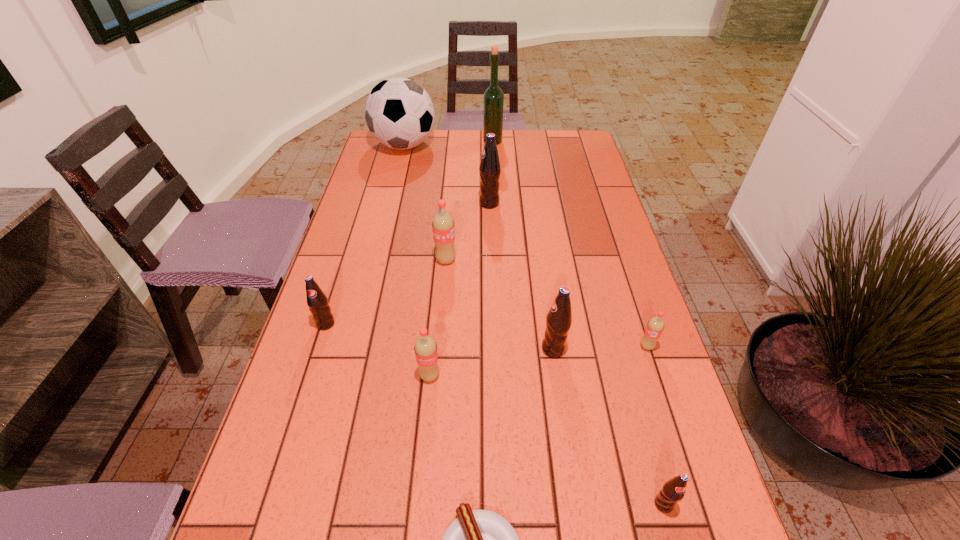
I want to click on the tallest object, so click(x=493, y=96).

I want to click on green liquor, so click(493, 96).

Locate an element on the screen. The image size is (960, 540). black soccer ball is located at coordinates (399, 113).

This screenshot has height=540, width=960. I want to click on the farthest black pop, so click(x=489, y=169).

This screenshot has height=540, width=960. Find the location of `the fourth pop from left to right`. the fourth pop from left to right is located at coordinates (489, 169).

Find the location of a particular element. Image resolution: width=960 pixels, height=540 pixels. the biggest red soda is located at coordinates 443,226.

Find the location of `the fourth farthest object`. the fourth farthest object is located at coordinates [x=443, y=226].

Locate an element on the screen. the second nearest black pop is located at coordinates (559, 318).

Find the location of `the third smallest black pop`. the third smallest black pop is located at coordinates (559, 318).

The width and height of the screenshot is (960, 540). I want to click on the leftmost black pop, so click(x=317, y=301).